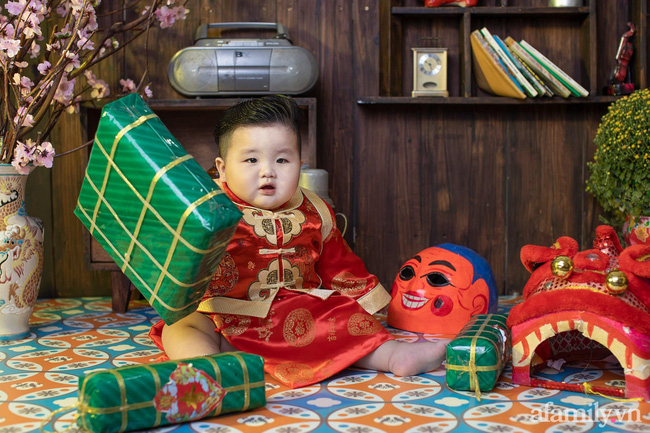
At what (x,y) coordinates should I click in order to perform the action: click on book. Please return your answer as a coordinate pair (x, y). Looking at the image, I should click on (487, 75), (523, 64), (523, 79), (563, 72).